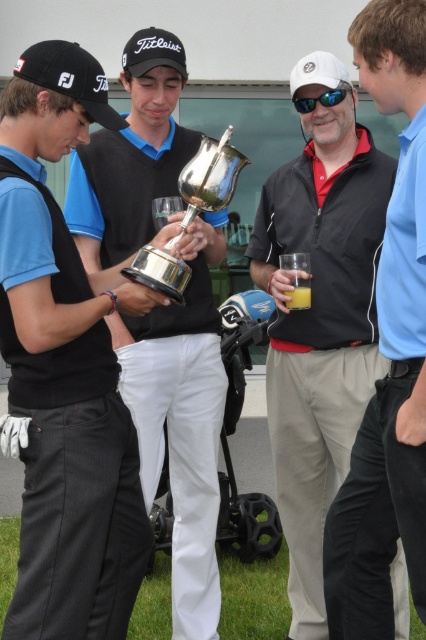
Between silver polished trophy at center and black fabric baseball cap at left, which one is positioned higher?

black fabric baseball cap at left is above.

Does silver polished trophy at center appear under black fabric baseball cap at left?

Yes.

Who is more distant from viewer, (x=164, y=248) or (x=34, y=54)?

Result: The point (x=164, y=248) is more distant.

Locate an element on the screen. Image resolution: width=426 pixels, height=640 pixels. silver polished trophy at center is located at coordinates (190, 212).

Is titleist matte black cap at upper center shorter than white matte baseball cap at upper center?

No, titleist matte black cap at upper center is not shorter than white matte baseball cap at upper center.

Does titleist matte black cap at upper center have a greater width compared to white matte baseball cap at upper center?

Correct, the width of titleist matte black cap at upper center exceeds that of white matte baseball cap at upper center.

The height and width of the screenshot is (640, 426). Identify the location of titleist matte black cap at upper center. (152, 52).

Does matte black jacket at center appear on the right side of titleist matte black cap at upper center?

Correct, you'll find matte black jacket at center to the right of titleist matte black cap at upper center.

Can you confirm if matte black jacket at center is taller than titleist matte black cap at upper center?

Correct, matte black jacket at center is much taller as titleist matte black cap at upper center.

Does point (389, 65) come in front of point (135, 49)?

Yes, point (389, 65) is in front of point (135, 49).

At what (x,y) coordinates should I click in order to perform the action: click on matte black jacket at center. Please return your answer as a coordinate pair (x, y). The image size is (426, 640). Looking at the image, I should click on (388, 355).